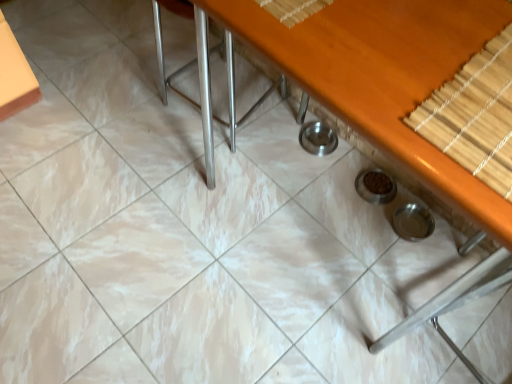
Question: Considering the relative sizes of bamboo mat at upper right and satin silver chair at center in the image provided, is bamboo mat at upper right smaller than satin silver chair at center?

Choices:
 (A) no
 (B) yes

Answer: (B)

Question: Can satin silver chair at center be found inside bamboo mat at upper right?

Choices:
 (A) no
 (B) yes

Answer: (A)

Question: Is bamboo mat at upper right far from satin silver chair at center?

Choices:
 (A) no
 (B) yes

Answer: (B)

Question: Is bamboo mat at upper right next to satin silver chair at center and touching it?

Choices:
 (A) yes
 (B) no

Answer: (B)

Question: Considering the relative sizes of bamboo mat at upper right and satin silver chair at center in the image provided, is bamboo mat at upper right taller than satin silver chair at center?

Choices:
 (A) no
 (B) yes

Answer: (A)

Question: From a real-world perspective, is wooden table at center physically located above or below satin silver chair at center?

Choices:
 (A) below
 (B) above

Answer: (B)

Question: From the image's perspective, is wooden table at center located above or below satin silver chair at center?

Choices:
 (A) above
 (B) below

Answer: (B)

Question: In terms of height, does wooden table at center look taller or shorter compared to satin silver chair at center?

Choices:
 (A) tall
 (B) short

Answer: (A)

Question: In terms of width, does wooden table at center look wider or thinner when compared to satin silver chair at center?

Choices:
 (A) thin
 (B) wide

Answer: (B)

Question: Does point (227, 34) appear closer or farther from the camera than point (440, 150)?

Choices:
 (A) closer
 (B) farther

Answer: (B)

Question: Based on their positions, is satin silver chair at center located to the left or right of bamboo mat at upper right?

Choices:
 (A) right
 (B) left

Answer: (B)

Question: Is satin silver chair at center taller or shorter than bamboo mat at upper right?

Choices:
 (A) tall
 (B) short

Answer: (A)

Question: From the image's perspective, is satin silver chair at center positioned above or below bamboo mat at upper right?

Choices:
 (A) below
 (B) above

Answer: (B)

Question: Is point (473, 147) positioned closer to the camera than point (206, 43)?

Choices:
 (A) closer
 (B) farther

Answer: (A)

Question: Considering the positions of bamboo mat at upper right and satin silver chair at center in the image, is bamboo mat at upper right bigger or smaller than satin silver chair at center?

Choices:
 (A) big
 (B) small

Answer: (B)